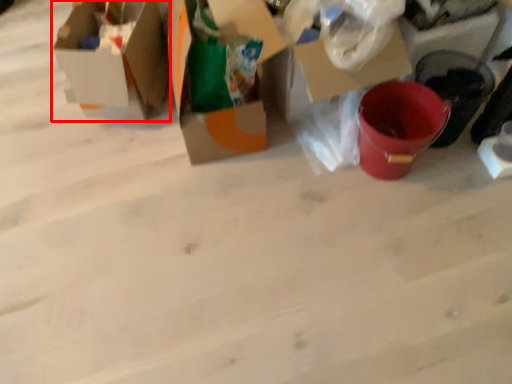
Question: Observing the image, what is the correct spatial positioning of box (annotated by the red box) in reference to box?

Choices:
 (A) left
 (B) right

Answer: (A)